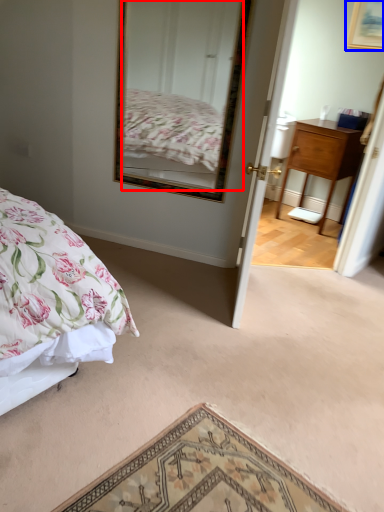
Question: Among these objects, which one is nearest to the camera, mirror (highlighted by a red box) or picture frame (highlighted by a blue box)?

Choices:
 (A) mirror
 (B) picture frame

Answer: (A)